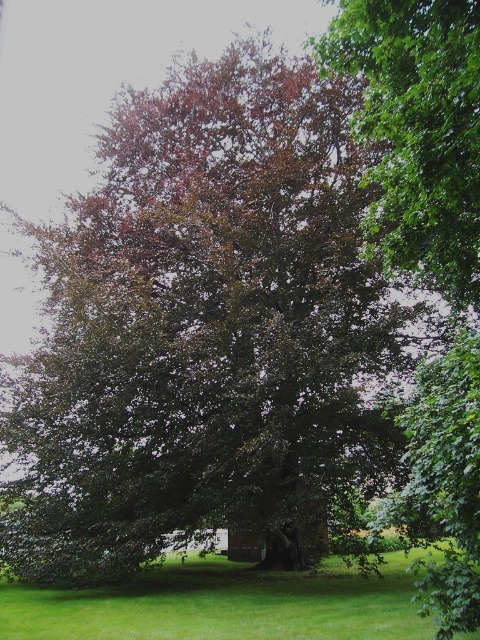
Who is positioned more to the left, green leafy tree at upper right or green grass at lower center?

green grass at lower center is more to the left.

Does green leafy tree at upper right have a greater height compared to green grass at lower center?

Incorrect, green leafy tree at upper right's height is not larger of green grass at lower center's.

Who is more forward, [383,17] or [154,570]?

Positioned in front is point [383,17].

You are a GUI agent. You are given a task and a screenshot of the screen. Output one action in this format:
    pyautogui.click(x=<x>, y=<y>)
    Task: Click on the green leafy tree at upper right
    This screenshot has height=640, width=480.
    Given the screenshot: What is the action you would take?
    pyautogui.click(x=419, y=131)